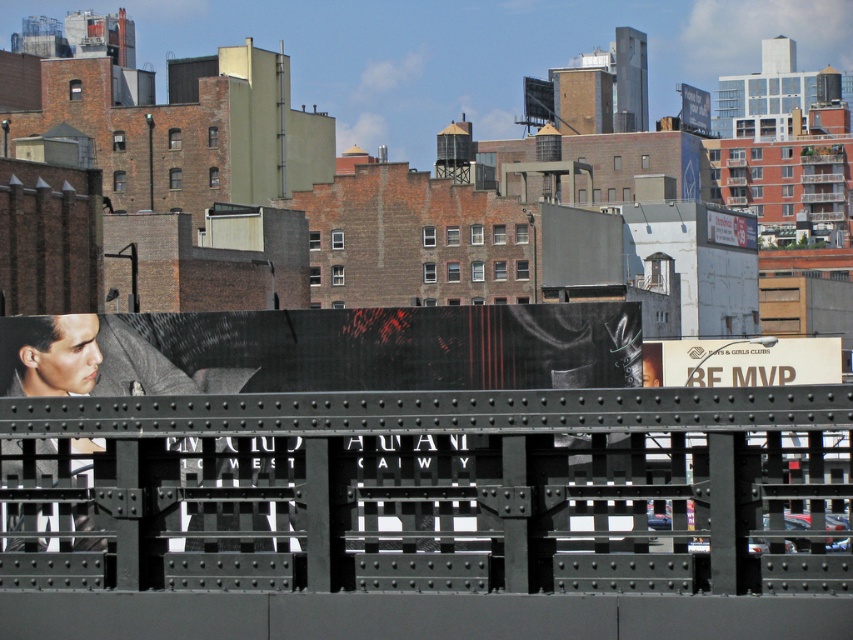
Identify the location of white cardboard sign at center. The width and height of the screenshot is (853, 640). (741, 362).

Which is more to the left, white cardboard sign at center or white glossy billboard at upper center?

white cardboard sign at center

Who is more forward, (693, 342) or (711, 240)?

Point (693, 342) is in front.

In order to click on white cardboard sign at center in this screenshot , I will do `click(741, 362)`.